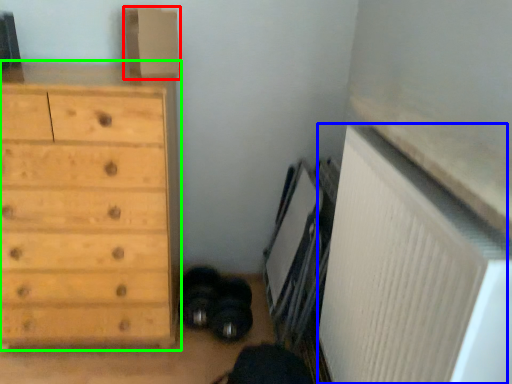
Question: Estimate the real-world distances between objects in this image. Which object is closer to cardboard box (highlighted by a red box), radiator (highlighted by a blue box) or chest of drawers (highlighted by a green box)?

Choices:
 (A) radiator
 (B) chest of drawers

Answer: (B)